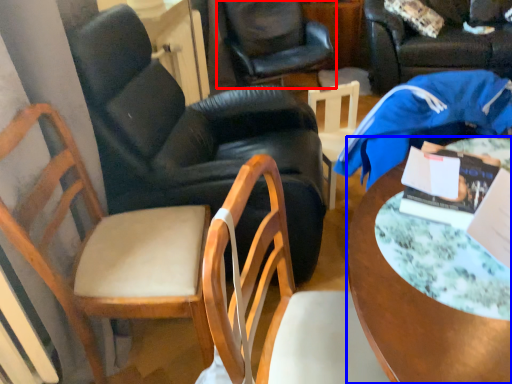
Question: Which of the following is the farthest to the observer, chair (highlighted by a red box) or desk (highlighted by a blue box)?

Choices:
 (A) chair
 (B) desk

Answer: (A)